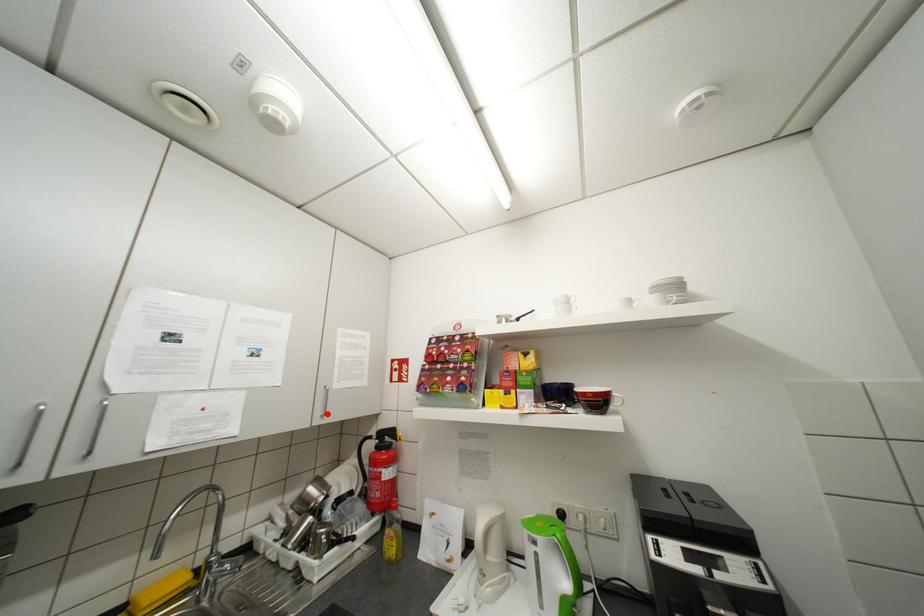
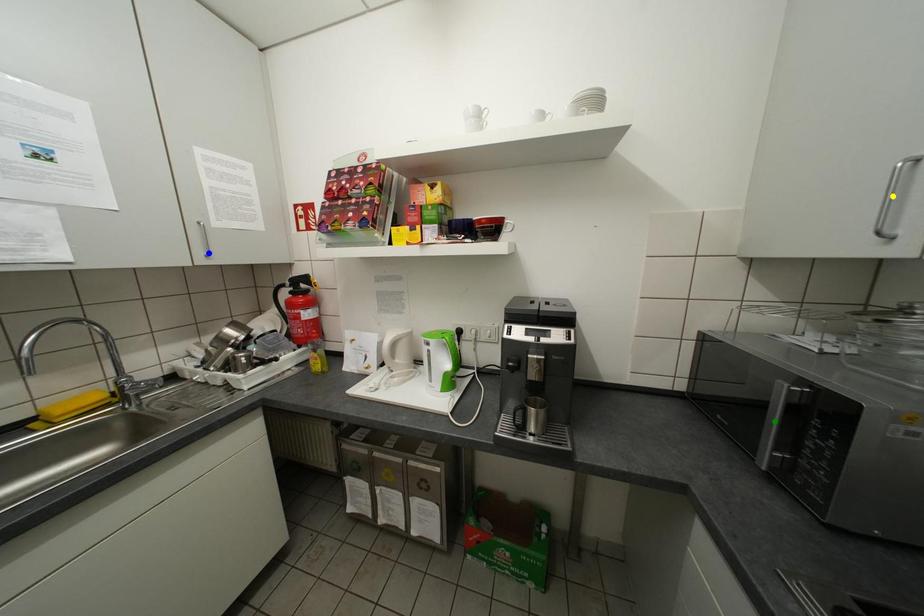
Question: I am providing you with two images of the same scene from different viewpoints. A red point is marked on the first image. You are given multiple points on the second image. Which spot in image 2 lines up with the point in image 1?

Choices:
 (A) green point
 (B) yellow point
 (C) blue point

Answer: (C)